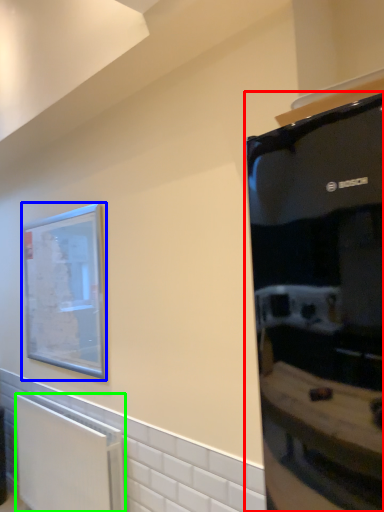
Question: Which object is positioned farthest from appliance (highlighted by a red box)? Select from picture frame (highlighted by a blue box) and radiator (highlighted by a green box).

Choices:
 (A) picture frame
 (B) radiator

Answer: (B)